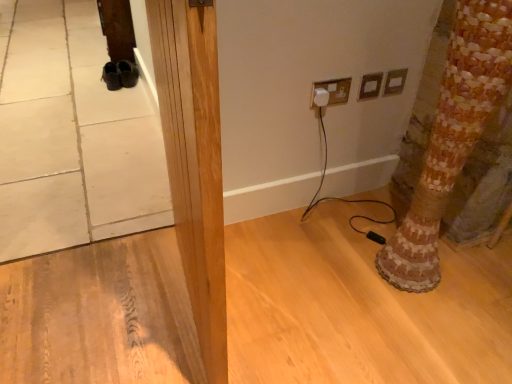
I want to click on free area in between wooden mosaic tree trunk at lower right and natural wood pillar at center, so click(x=303, y=291).